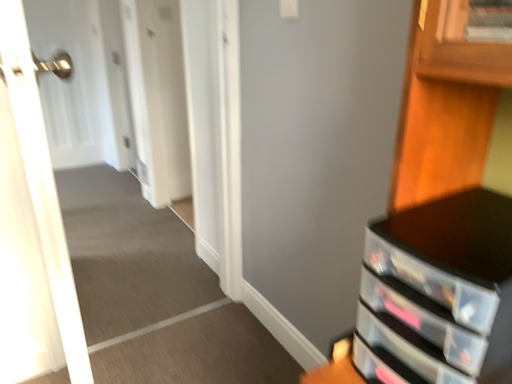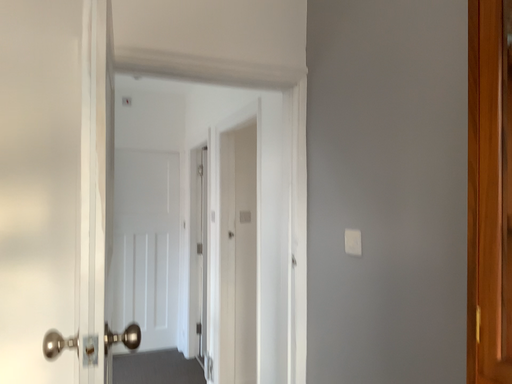
Question: How did the camera likely rotate when shooting the video?

Choices:
 (A) rotated downward
 (B) rotated upward

Answer: (B)